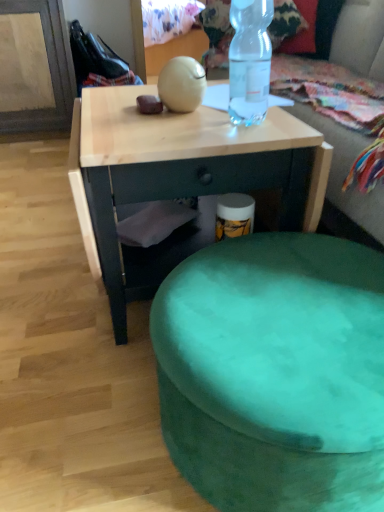
Question: Is transparent plastic bottle at upper center to the left or to the right of velvet green ottoman at lower center in the image?

Choices:
 (A) right
 (B) left

Answer: (B)

Question: Is transparent plastic bottle at upper center bigger or smaller than velvet green ottoman at lower center?

Choices:
 (A) big
 (B) small

Answer: (B)

Question: Based on their relative distances, which object is farther from the transparent plastic bottle at upper center?

Choices:
 (A) velvet green ottoman at lower center
 (B) natural wood desk at center
 (C) green fabric bean bag at upper center

Answer: (C)

Question: Which is farther from the natural wood desk at center?

Choices:
 (A) transparent plastic bottle at upper center
 (B) velvet green ottoman at lower center
 (C) green fabric bean bag at upper center

Answer: (C)